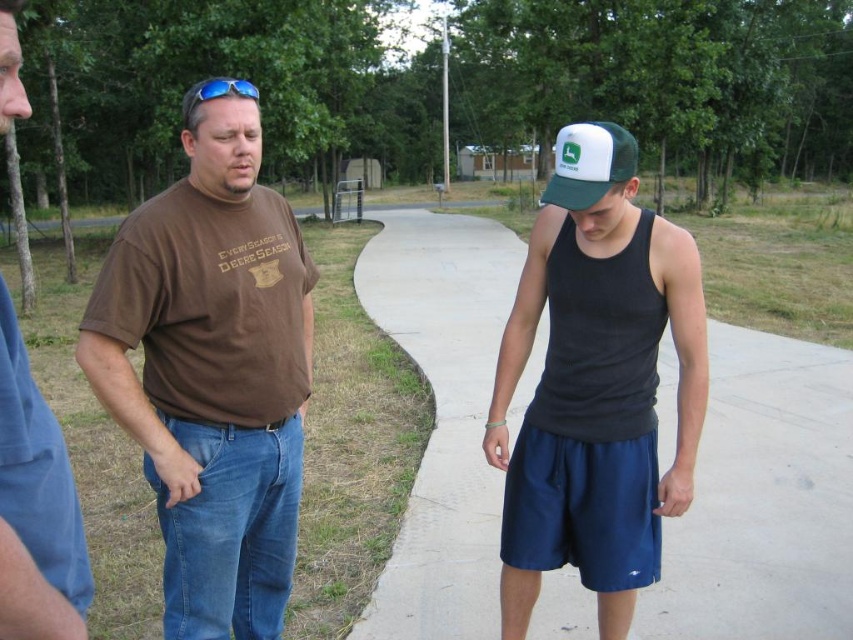
Question: Which point appears farthest from the camera in this image?

Choices:
 (A) (608, 138)
 (B) (221, 444)
 (C) (500, 541)

Answer: (C)

Question: Which object appears closest to the camera in this image?

Choices:
 (A) brown cotton t-shirt at center
 (B) white mesh baseball cap at upper center
 (C) smooth concrete sidewalk at center

Answer: (A)

Question: Is smooth concrete sidewalk at center wider than white mesh baseball cap at upper center?

Choices:
 (A) yes
 (B) no

Answer: (A)

Question: Which point appears closest to the camera in this image?

Choices:
 (A) (813, 548)
 (B) (560, 429)
 (C) (15, 419)

Answer: (C)

Question: Is black matte tank top at center bigger than white mesh baseball cap at upper center?

Choices:
 (A) no
 (B) yes

Answer: (A)

Question: Can you confirm if smooth concrete sidewalk at center is smaller than white mesh baseball cap at upper center?

Choices:
 (A) yes
 (B) no

Answer: (B)